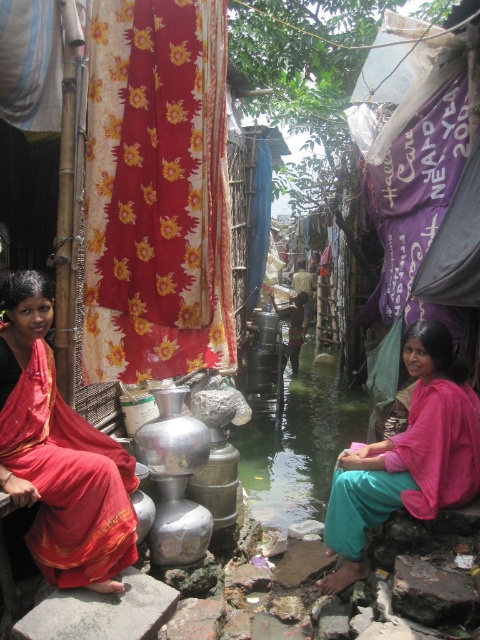
Is floral fabric curtain at upper left shorter than matte red sari at left?

In fact, floral fabric curtain at upper left may be taller than matte red sari at left.

Between floral fabric curtain at upper left and matte red sari at left, which one has less height?

matte red sari at left is shorter.

Does point (206, 6) lie behind point (12, 292)?

Yes, point (206, 6) is behind point (12, 292).

Where is `floral fabric curtain at upper left`? floral fabric curtain at upper left is located at coordinates (156, 192).

Which is behind, point (126, 467) or point (396, 499)?

Positioned behind is point (396, 499).

Based on the photo, how far apart are matte red sari at left and pink fabric at lower right?

matte red sari at left and pink fabric at lower right are 5.84 feet apart.

Is point (31, 460) positioned before point (418, 413)?

Yes, it is.

You are a GUI agent. You are given a task and a screenshot of the screen. Output one action in this format:
    pyautogui.click(x=<x>, y=<y>)
    Task: Click on the matte red sari at left
    The image size is (480, 640).
    Given the screenshot: What is the action you would take?
    pyautogui.click(x=59, y=452)

Which of these two, floral fabric curtain at upper left or pink fabric at lower right, stands taller?

floral fabric curtain at upper left

Who is more forward, (215, 131) or (477, 452)?

Point (215, 131) is in front.

Find the location of `floral fabric curtain at upper left`. floral fabric curtain at upper left is located at coordinates (156, 192).